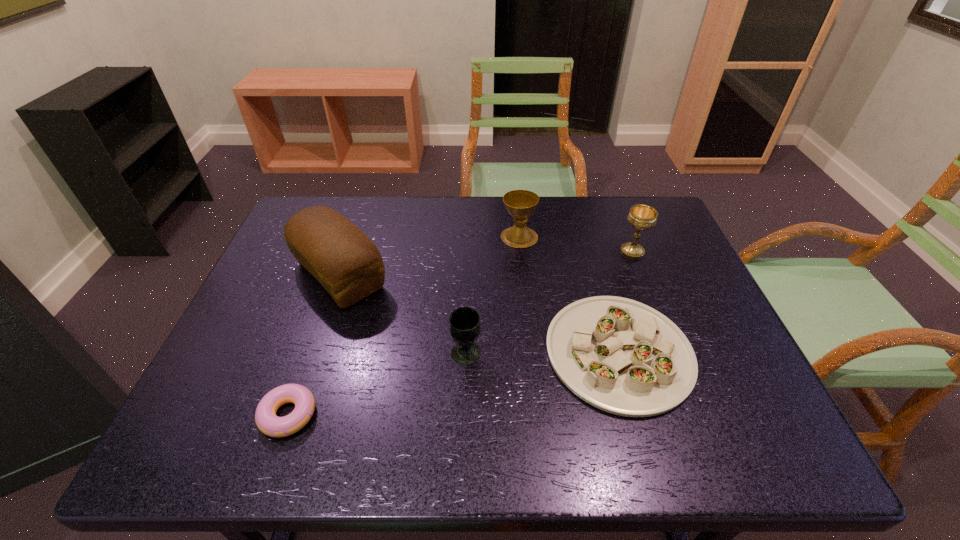
At what (x,y) coordinates should I click in order to perform the action: click on free spot between the nearest chalice and the second chalice from left to right. Please return your answer as a coordinate pair (x, y). Looking at the image, I should click on 492,295.

Locate an element on the screen. empty space that is in between the nearest chalice and the fifth tallest object is located at coordinates (542, 353).

What are the coordinates of `free space between the leftmost chalice and the platter` in the screenshot? It's located at (542, 353).

Where is `blank region between the leftmost chalice and the fifth tallest object`? This screenshot has height=540, width=960. blank region between the leftmost chalice and the fifth tallest object is located at coordinates (542, 353).

At what (x,y) coordinates should I click in order to perform the action: click on vacant point located between the bread and the rightmost chalice. Please return your answer as a coordinate pair (x, y). Looking at the image, I should click on (486, 264).

I want to click on free spot between the rightmost chalice and the second chalice from left to right, so click(x=576, y=245).

I want to click on empty location between the leftmost chalice and the platter, so click(542, 353).

Where is `empty space that is in between the nearest chalice and the second shortest object`? Image resolution: width=960 pixels, height=540 pixels. empty space that is in between the nearest chalice and the second shortest object is located at coordinates (542, 353).

Where is `object that is the second closest to the tallest object`? The width and height of the screenshot is (960, 540). object that is the second closest to the tallest object is located at coordinates point(268,423).

Identify the location of object identified as the third closest to the tallest object. The width and height of the screenshot is (960, 540). (520, 204).